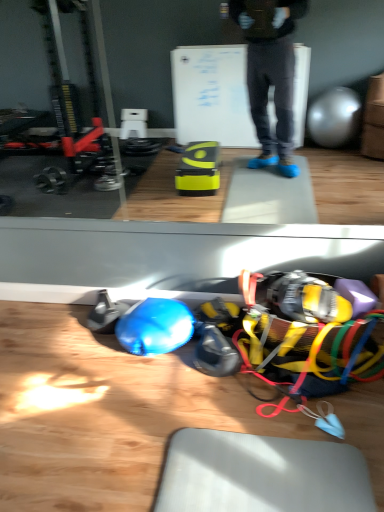
Describe the element at coordinates (155, 326) in the screenshot. The height and width of the screenshot is (512, 384). I see `blue glossy helmet at lower left` at that location.

Where is `blue glossy helmet at lower left`? This screenshot has height=512, width=384. blue glossy helmet at lower left is located at coordinates (155, 326).

Based on the photo, measure the distance between blue glossy helmet at lower left and camera.

They are 5.49 feet apart.

This screenshot has width=384, height=512. In order to click on blue glossy helmet at lower left in this screenshot , I will do `click(155, 326)`.